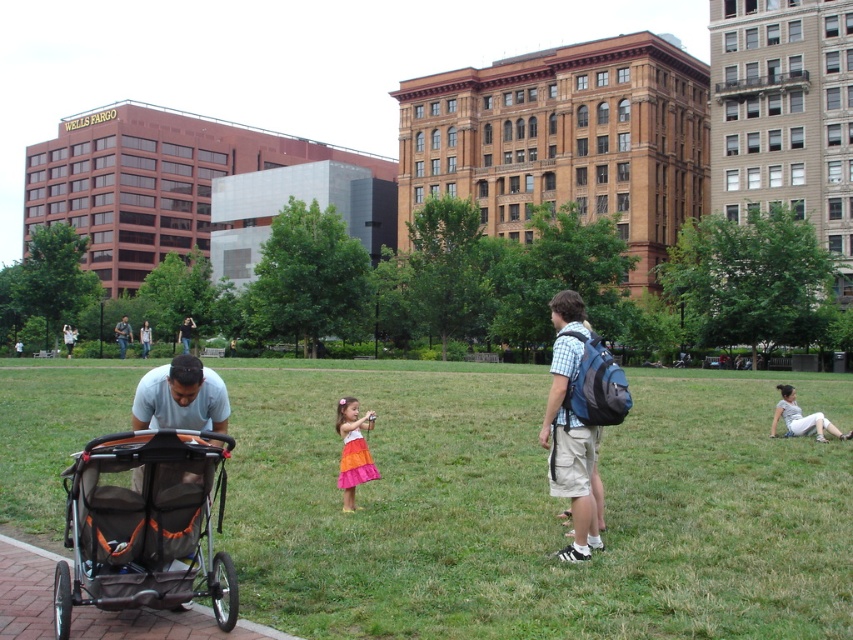
Question: Is blue plaid shirt at center thinner than blue denim jeans at center?

Choices:
 (A) yes
 (B) no

Answer: (A)

Question: Which of the following is the farthest from the observer?

Choices:
 (A) (850, 435)
 (B) (549, 538)

Answer: (A)

Question: Which object is the farthest from the blue denim jeans at center?

Choices:
 (A) orange cotton dress at center
 (B) blue plaid shirt at center

Answer: (A)

Question: Does orange cotton dress at center have a smaller size compared to white cotton pants at lower right?

Choices:
 (A) yes
 (B) no

Answer: (A)

Question: Which point is farther to the camera?

Choices:
 (A) blue plaid shirt at center
 (B) orange mesh baby carriage at lower left

Answer: (A)

Question: Is orange mesh baby carriage at lower left to the right of orange cotton dress at center from the viewer's perspective?

Choices:
 (A) yes
 (B) no

Answer: (B)